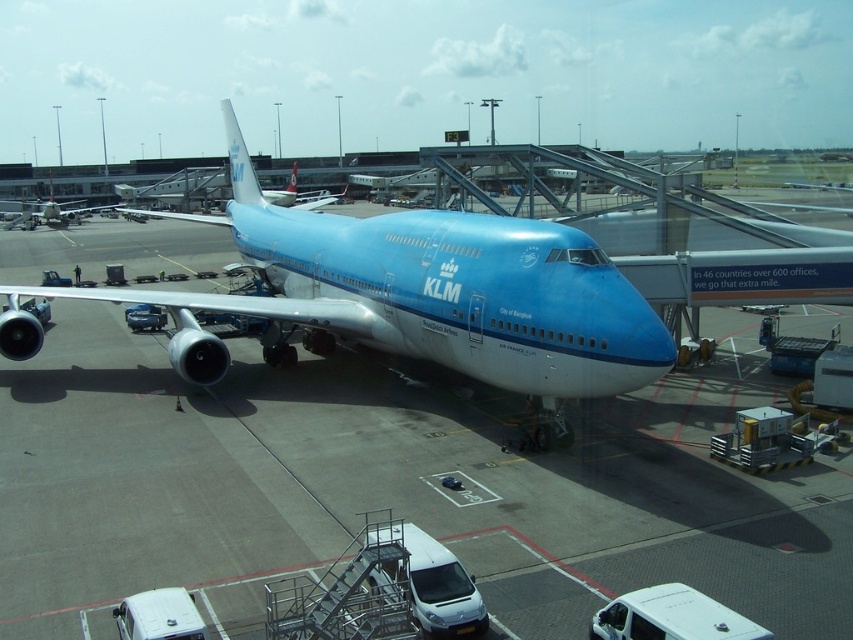
Consider the image. Between blue glossy airplane at center and matte blue airplane at center, which one has less height?

blue glossy airplane at center is shorter.

Can you confirm if blue glossy airplane at center is positioned to the left of matte blue airplane at center?

No, blue glossy airplane at center is not to the left of matte blue airplane at center.

Which is in front, point (61, 429) or point (242, 141)?

Point (61, 429) is more forward.

Locate an element on the screen. The height and width of the screenshot is (640, 853). blue glossy airplane at center is located at coordinates (393, 484).